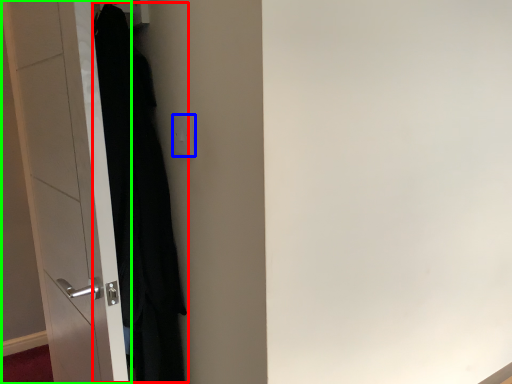
Question: Based on their relative distances, which object is nearer to clothing (highlighted by a red box)? Choose from electric outlet (highlighted by a blue box) and door (highlighted by a green box).

Choices:
 (A) electric outlet
 (B) door

Answer: (B)